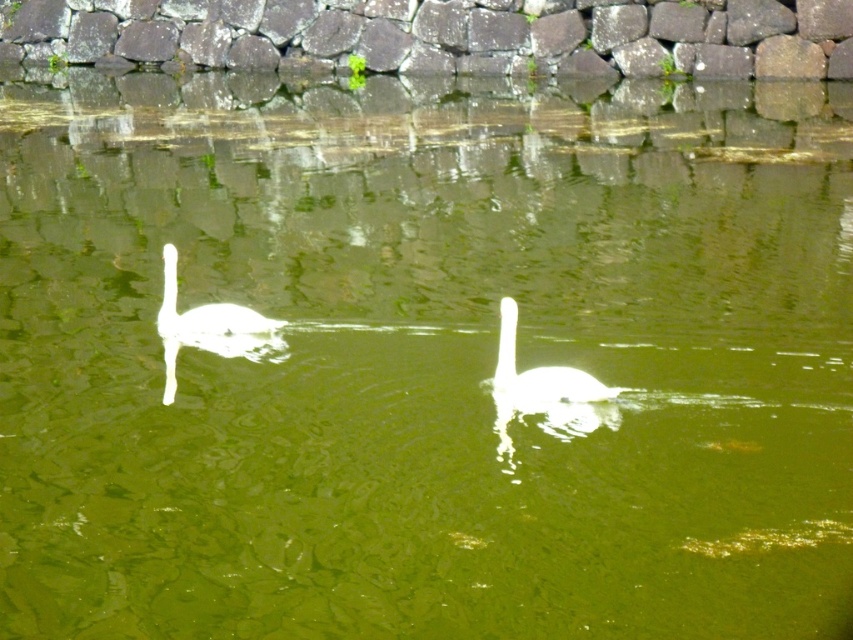
Question: Considering the relative positions of white glossy swan at center and white glossy swan at left in the image provided, where is white glossy swan at center located with respect to white glossy swan at left?

Choices:
 (A) above
 (B) below

Answer: (B)

Question: Among these points, which one is farthest from the camera?

Choices:
 (A) (224, 323)
 (B) (508, 298)

Answer: (A)

Question: Does white glossy swan at center appear over white glossy swan at left?

Choices:
 (A) no
 (B) yes

Answer: (A)

Question: Is white glossy swan at center smaller than white glossy swan at left?

Choices:
 (A) yes
 (B) no

Answer: (A)